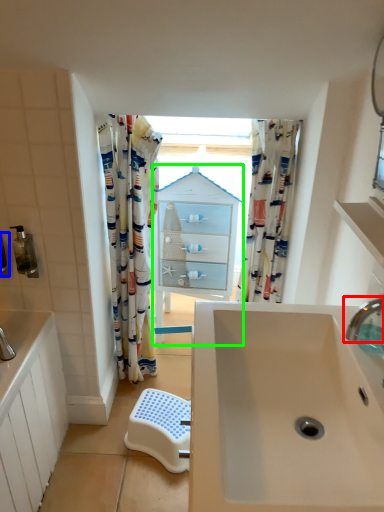
Question: Which object is the closest to the tap (highlighted by a red box)? Choose among these: toiletry (highlighted by a blue box) or medicine cabinet (highlighted by a green box).

Choices:
 (A) toiletry
 (B) medicine cabinet

Answer: (B)